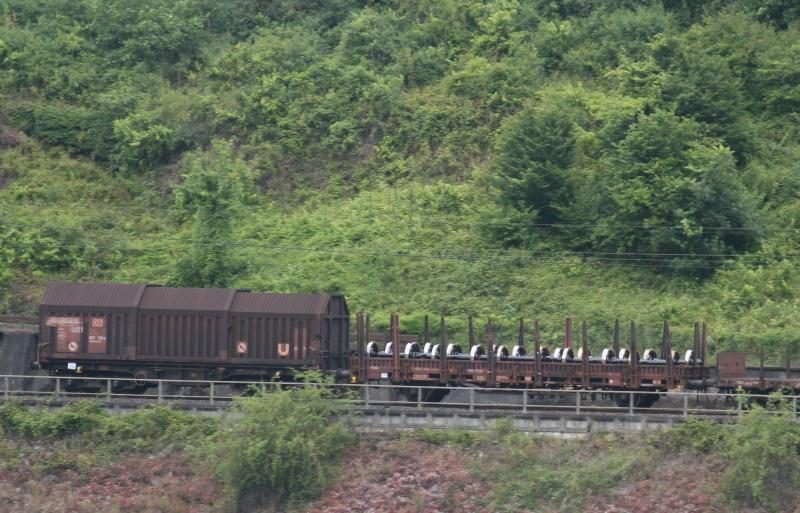
What are the coordinates of `storage` in the screenshot? It's located at [x=589, y=370], [x=173, y=339].